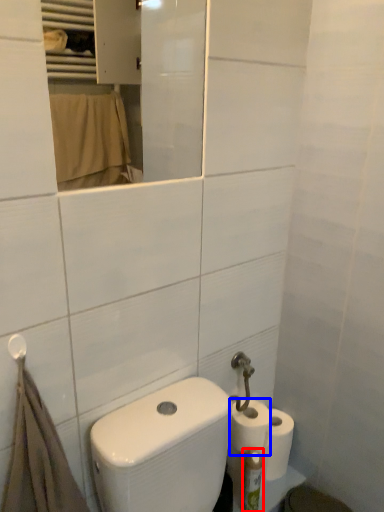
Question: Which object appears closest to the camera in this image, toiletry (highlighted by a red box) or toilet paper (highlighted by a blue box)?

Choices:
 (A) toiletry
 (B) toilet paper

Answer: (A)